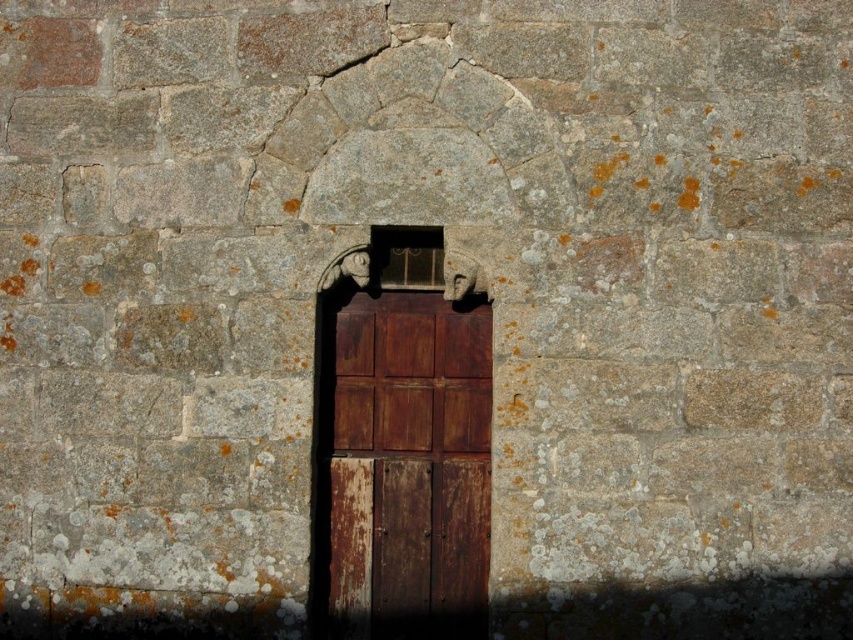
Who is higher up, rusty wood door at center or matte metal window at center?

Positioned higher is matte metal window at center.

Between rusty wood door at center and matte metal window at center, which one has more height?

A: rusty wood door at center

Does point (479, 477) lie in front of point (399, 285)?

Yes, point (479, 477) is closer to viewer.

The image size is (853, 640). In order to click on rusty wood door at center in this screenshot , I will do tap(408, 467).